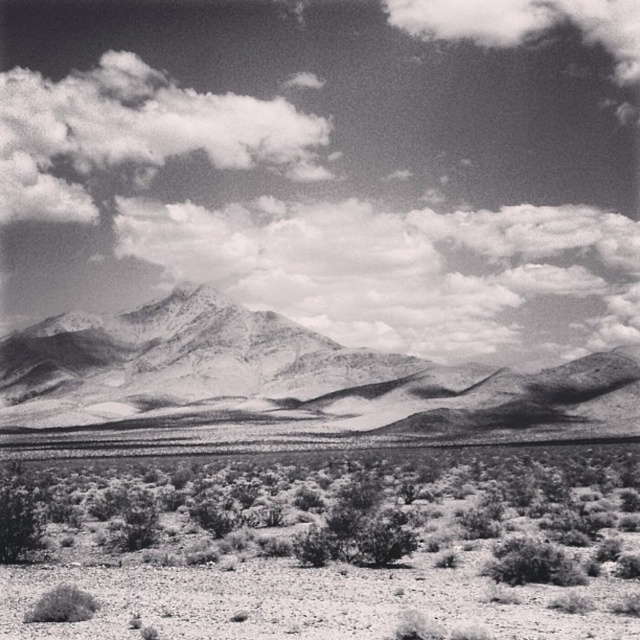
How far apart are gravelly desert shrubs at lower center and cloudy sky at upper left?

gravelly desert shrubs at lower center is 405.84 meters away from cloudy sky at upper left.

Does gravelly desert shrubs at lower center have a lesser width compared to cloudy sky at upper left?

Yes, gravelly desert shrubs at lower center is thinner than cloudy sky at upper left.

Describe the element at coordinates (340, 548) in the screenshot. Image resolution: width=640 pixels, height=640 pixels. I see `gravelly desert shrubs at lower center` at that location.

Locate an element on the screen. The image size is (640, 640). gravelly desert shrubs at lower center is located at coordinates (340, 548).

Is cloudy sky at upper center wider than gravelly desert shrubs at lower center?

Yes, cloudy sky at upper center is wider than gravelly desert shrubs at lower center.

Where is `cloudy sky at upper center`? cloudy sky at upper center is located at coordinates (330, 164).

Who is shorter, cloudy sky at upper center or smooth gray mountain range at center?

smooth gray mountain range at center

Is cloudy sky at upper center taller than smooth gray mountain range at center?

Yes.

Which is in front, point (241, 241) or point (372, 355)?

Point (372, 355) is more forward.

You are a GUI agent. You are given a task and a screenshot of the screen. Output one action in this format:
    pyautogui.click(x=<x>, y=<y>)
    Task: Click on the cloudy sky at upper center
    The width and height of the screenshot is (640, 640).
    Given the screenshot: What is the action you would take?
    pyautogui.click(x=330, y=164)